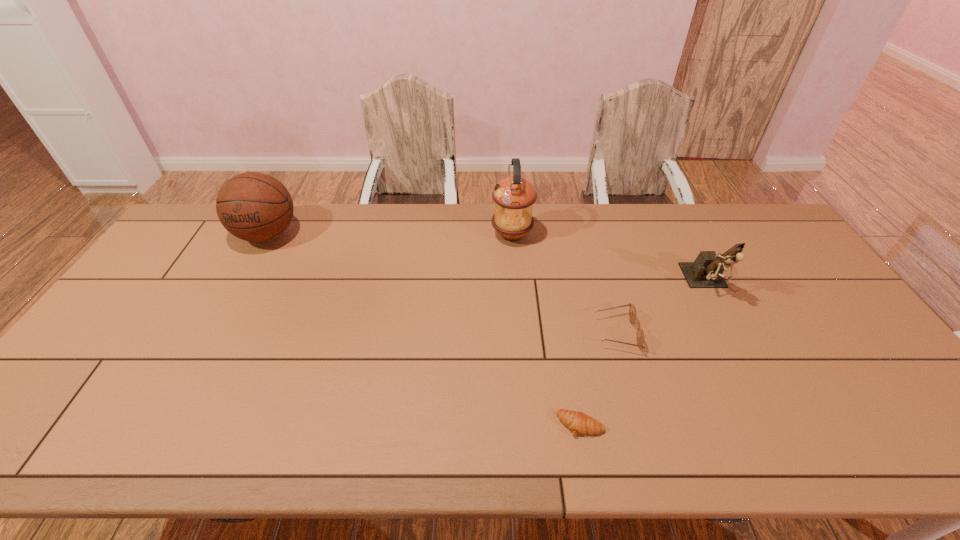
Image resolution: width=960 pixels, height=540 pixels. Identify the location of vacant space at the left edge of the desktop. (149, 314).

Find the location of a particular element. The height and width of the screenshot is (540, 960). free space at the right edge is located at coordinates (780, 264).

The width and height of the screenshot is (960, 540). In order to click on free space at the far left corner of the desktop in this screenshot , I will do `click(214, 211)`.

The image size is (960, 540). Find the location of `free space at the near left corner`. free space at the near left corner is located at coordinates (37, 426).

Find the location of a particular element. This screenshot has width=960, height=540. blank space at the near right corner of the desktop is located at coordinates (917, 444).

Where is `free space between the oil lamp and the crescent roll`? The height and width of the screenshot is (540, 960). free space between the oil lamp and the crescent roll is located at coordinates (546, 329).

Identify the location of vacant point located between the basketball and the tallest object. (390, 235).

Locate an element on the screen. This screenshot has height=540, width=960. vacant area that lies between the leftmost object and the tallest object is located at coordinates (390, 235).

At what (x,y) coordinates should I click in order to perform the action: click on vacant space in between the spectacles and the leftmost object. Please return your answer as a coordinate pair (x, y). The height and width of the screenshot is (540, 960). Looking at the image, I should click on (442, 284).

The width and height of the screenshot is (960, 540). Find the location of `vacant point located between the basketball and the shortest object`. vacant point located between the basketball and the shortest object is located at coordinates (423, 329).